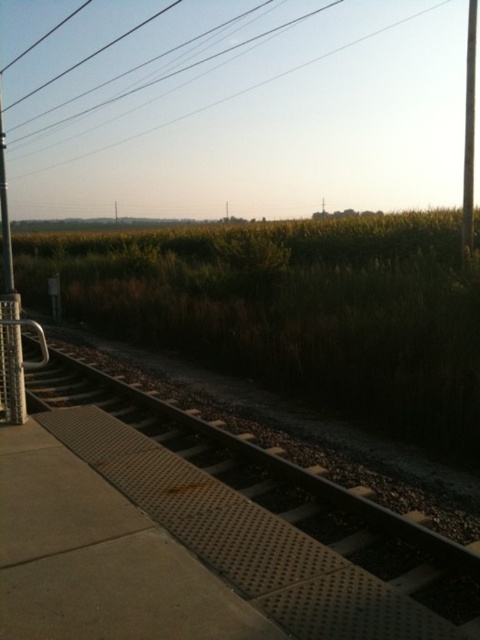
Question: Where is brown textured track at center located in relation to metallic wires at upper center in the image?

Choices:
 (A) right
 (B) left

Answer: (A)

Question: Does metallic wires at upper center have a larger size compared to metallic pole at right?

Choices:
 (A) yes
 (B) no

Answer: (B)

Question: Which object is farther from the camera taking this photo?

Choices:
 (A) brown textured track at center
 (B) metallic pole at right
 (C) metallic pole at left

Answer: (B)

Question: Is brown textured track at center below metallic pole at left?

Choices:
 (A) yes
 (B) no

Answer: (A)

Question: Which is nearer to the metallic pole at right?

Choices:
 (A) metallic pole at left
 (B) metallic wires at upper center

Answer: (B)

Question: Which object is the farthest from the metallic wires at upper center?

Choices:
 (A) brown textured track at center
 (B) metallic pole at right

Answer: (A)